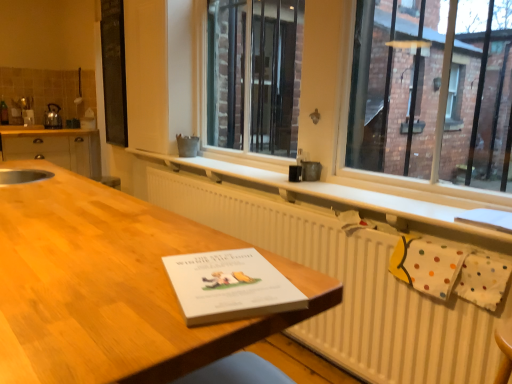
Question: Considering the positions of matte wood cabinets at left and clear glass window at center in the image, is matte wood cabinets at left taller or shorter than clear glass window at center?

Choices:
 (A) tall
 (B) short

Answer: (B)

Question: From a real-world perspective, relative to clear glass window at center, is matte wood cabinets at left vertically above or below?

Choices:
 (A) above
 (B) below

Answer: (B)

Question: Which object is positioned closest to the wooden table at center?

Choices:
 (A) clear glass window at center
 (B) white paper at center
 (C) white matte radiator at lower center
 (D) metallic silver kettle at left
 (E) white textured radiator at center

Answer: (B)

Question: Which is farther from the matte wood cabinets at left?

Choices:
 (A) clear glass window at center
 (B) white matte radiator at lower center
 (C) white paper at center
 (D) black matte board at upper left
 (E) white textured radiator at center

Answer: (C)